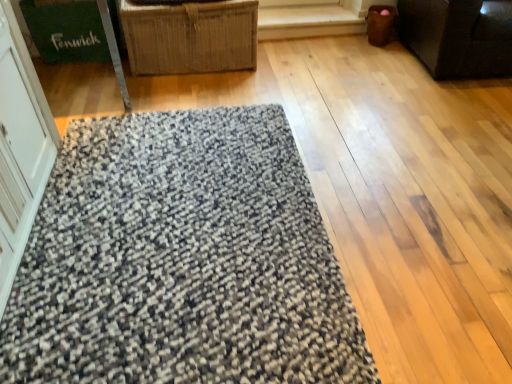
Where is `vacant space to the right of white glossy screen door at left`? This screenshot has height=384, width=512. vacant space to the right of white glossy screen door at left is located at coordinates (151, 235).